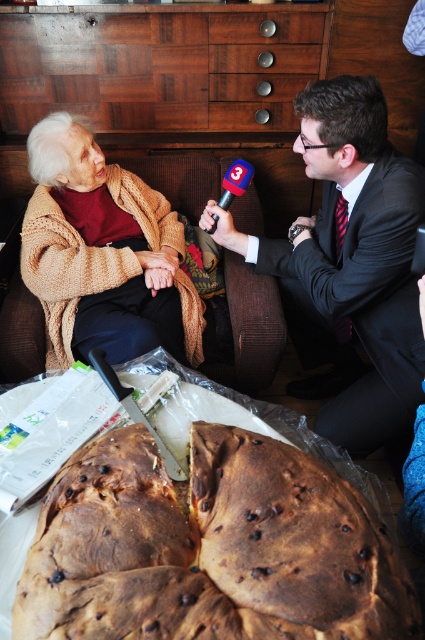
You are a photographer setting up a shoot in the scene. You need to ensure that the brown crumbly bread at center and the knitted beige sweater at upper left are both visible in the shot. Which object should be placed closer to the camera to achieve this?

The brown crumbly bread at center should be placed closer to the camera because it is already positioned in front of the knitted beige sweater at upper left, so adjusting its position would ensure both are visible.

You are a photographer positioned at the entrance of the room. You need to take a photo of both the dark suit at center and the knitted beige sweater at upper left. Given that your camera has a maximum focus range of 18 inches, will you be able to capture both subjects in focus without moving the camera?

The distance between the dark suit at center and the knitted beige sweater at upper left is 17.48 inches, which is within the camera maximum focus range of 18 inches. Therefore, both subjects can be captured in focus without moving the camera.